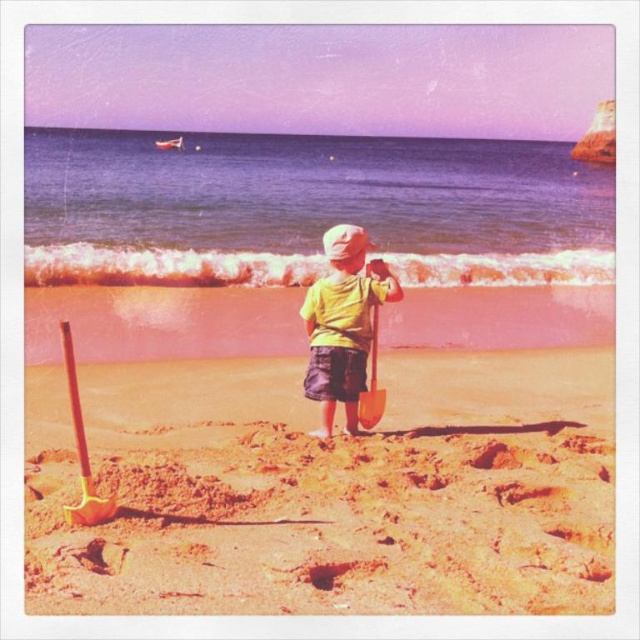
Question: Is the position of smooth sand shovel at center less distant than that of metallic gold shovel at center?

Choices:
 (A) no
 (B) yes

Answer: (B)

Question: Considering the real-world distances, which object is closest to the wooden shovel at lower left?

Choices:
 (A) metallic gold shovel at center
 (B) smooth sand shovel at center

Answer: (B)

Question: Can you confirm if yellow matte shirt at center is positioned above wooden shovel at lower left?

Choices:
 (A) no
 (B) yes

Answer: (B)

Question: Which point is closer to the camera taking this photo?

Choices:
 (A) (326, 554)
 (B) (72, 387)
 (C) (330, 364)
 (D) (372, 333)

Answer: (A)

Question: Which object is farther from the camera taking this photo?

Choices:
 (A) smooth sand shovel at center
 (B) metallic gold shovel at center
 (C) wooden shovel at lower left

Answer: (B)

Question: Can you confirm if yellow matte shirt at center is wider than wooden shovel at lower left?

Choices:
 (A) no
 (B) yes

Answer: (B)